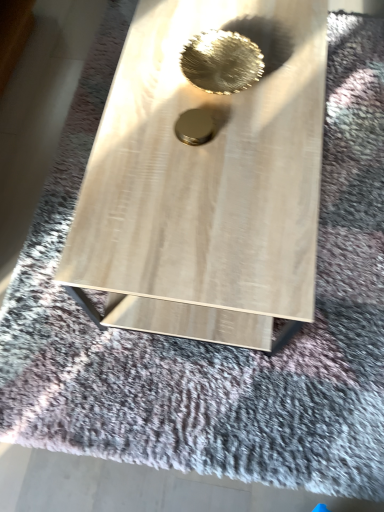
Question: Is gold metallic circle at center, arranged as the first hole when ordered from the bottom, in front of or behind metallic gold bowl at center, acting as the 2th hole starting from the bottom, in the image?

Choices:
 (A) behind
 (B) front

Answer: (B)

Question: Visually, is gold metallic circle at center, the second hole in the top-to-bottom sequence, positioned to the left or to the right of metallic gold bowl at center, arranged as the first hole when viewed from the top?

Choices:
 (A) left
 (B) right

Answer: (A)

Question: Considering the positions of gold metallic circle at center, the second hole in the top-to-bottom sequence, and metallic gold bowl at center, arranged as the first hole when viewed from the top, in the image, is gold metallic circle at center, the second hole in the top-to-bottom sequence, bigger or smaller than metallic gold bowl at center, arranged as the first hole when viewed from the top,?

Choices:
 (A) small
 (B) big

Answer: (A)

Question: In terms of size, does metallic gold bowl at center, arranged as the first hole when viewed from the top, appear bigger or smaller than gold metallic circle at center, the second hole in the top-to-bottom sequence?

Choices:
 (A) small
 (B) big

Answer: (B)

Question: Is metallic gold bowl at center, arranged as the first hole when viewed from the top, situated inside gold metallic circle at center, the second hole in the top-to-bottom sequence, or outside?

Choices:
 (A) inside
 (B) outside

Answer: (B)

Question: Would you say metallic gold bowl at center, arranged as the first hole when viewed from the top, is to the left or to the right of gold metallic circle at center, the second hole in the top-to-bottom sequence, in the picture?

Choices:
 (A) left
 (B) right

Answer: (B)

Question: From the image's perspective, is metallic gold bowl at center, acting as the 2th hole starting from the bottom, positioned above or below gold metallic circle at center, arranged as the first hole when ordered from the bottom?

Choices:
 (A) below
 (B) above

Answer: (B)